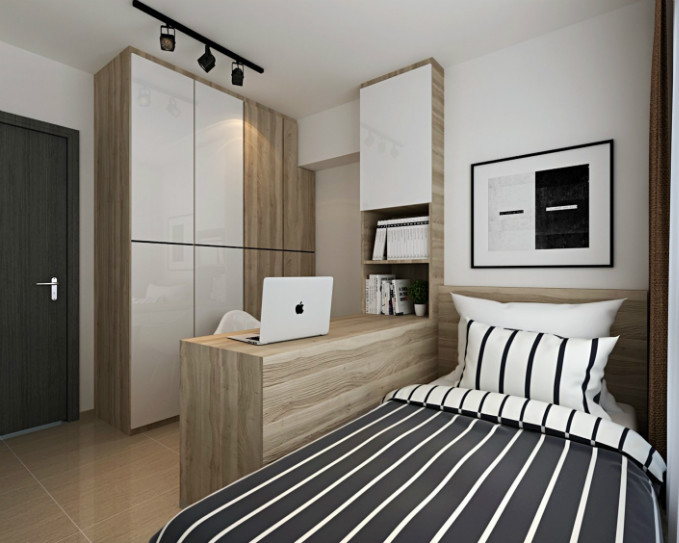
Where is `bed`? This screenshot has width=679, height=543. bed is located at coordinates (627, 415).